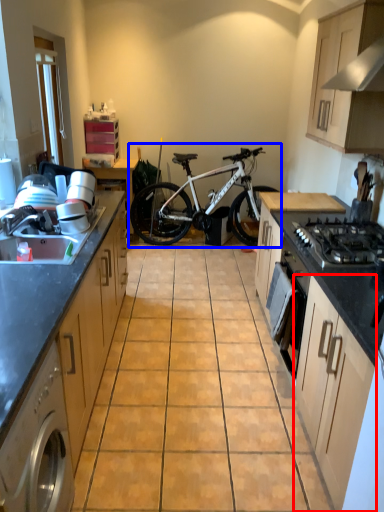
Question: Among these objects, which one is farthest to the camera, cabinetry (highlighted by a red box) or bicycle (highlighted by a blue box)?

Choices:
 (A) cabinetry
 (B) bicycle

Answer: (B)